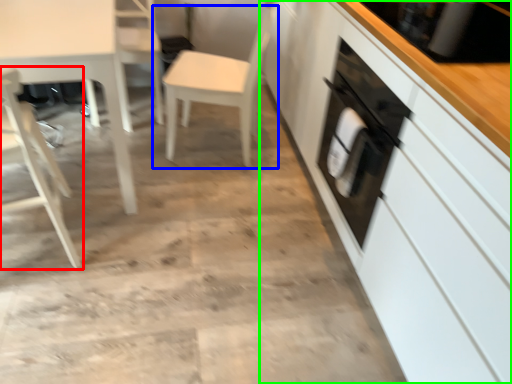
Question: Considering the real-world distances, which object is closest to chair (highlighted by a red box)? chair (highlighted by a blue box) or cabinetry (highlighted by a green box).

Choices:
 (A) chair
 (B) cabinetry

Answer: (A)